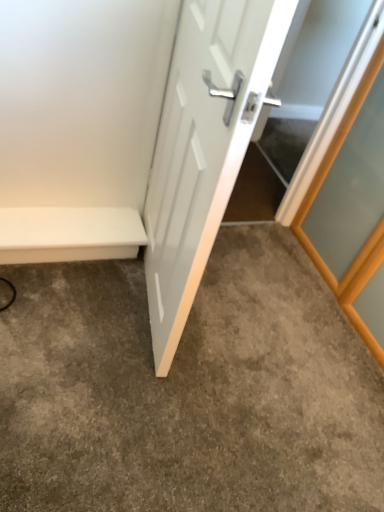
Question: Could you tell me if white matte bench at lower left is turned towards gray carpet at center?

Choices:
 (A) no
 (B) yes

Answer: (B)

Question: Does white matte bench at lower left have a larger size compared to gray carpet at center?

Choices:
 (A) yes
 (B) no

Answer: (B)

Question: Is white matte bench at lower left shorter than gray carpet at center?

Choices:
 (A) yes
 (B) no

Answer: (B)

Question: Is the depth of white matte bench at lower left greater than that of gray carpet at center?

Choices:
 (A) yes
 (B) no

Answer: (A)

Question: Considering the relative sizes of white matte bench at lower left and gray carpet at center in the image provided, is white matte bench at lower left wider than gray carpet at center?

Choices:
 (A) yes
 (B) no

Answer: (B)

Question: Considering their positions, is gray carpet at center located in front of or behind white matte bench at lower left?

Choices:
 (A) front
 (B) behind

Answer: (A)

Question: From the image's perspective, is gray carpet at center located above or below white matte bench at lower left?

Choices:
 (A) below
 (B) above

Answer: (A)

Question: Looking at their shapes, would you say gray carpet at center is wider or thinner than white matte bench at lower left?

Choices:
 (A) thin
 (B) wide

Answer: (B)

Question: In terms of height, does gray carpet at center look taller or shorter compared to white matte bench at lower left?

Choices:
 (A) short
 (B) tall

Answer: (A)

Question: Would you say white matte bench at lower left is to the left or to the right of gray carpet at center in the picture?

Choices:
 (A) right
 (B) left

Answer: (B)

Question: Is white matte bench at lower left taller or shorter than gray carpet at center?

Choices:
 (A) tall
 (B) short

Answer: (A)

Question: Based on their sizes in the image, would you say white matte bench at lower left is bigger or smaller than gray carpet at center?

Choices:
 (A) small
 (B) big

Answer: (A)

Question: Looking at their shapes, would you say white matte bench at lower left is wider or thinner than gray carpet at center?

Choices:
 (A) thin
 (B) wide

Answer: (A)

Question: In terms of size, does white glossy door at center appear bigger or smaller than white matte bench at lower left?

Choices:
 (A) big
 (B) small

Answer: (A)

Question: From a real-world perspective, is white glossy door at center above or below white matte bench at lower left?

Choices:
 (A) below
 (B) above

Answer: (B)